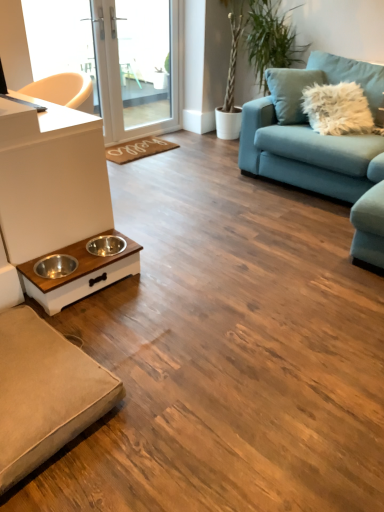
At what (x,y) coordinates should I click in order to perform the action: click on vacant point to the right of beige fabric studio couch at lower left, which is counted as the second studio couch, starting from the right. Please return your answer as a coordinate pair (x, y). Looking at the image, I should click on point(176,389).